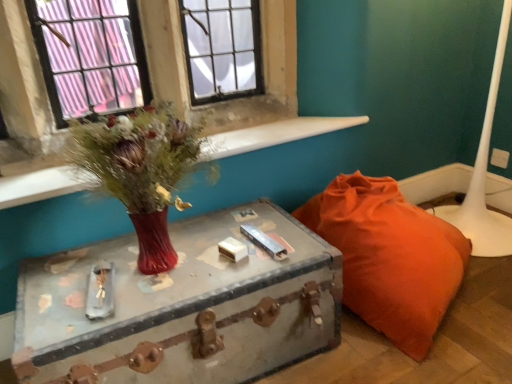
Identify the location of free space below matte red vase at upper left (from a real-world perspective). The width and height of the screenshot is (512, 384). (168, 270).